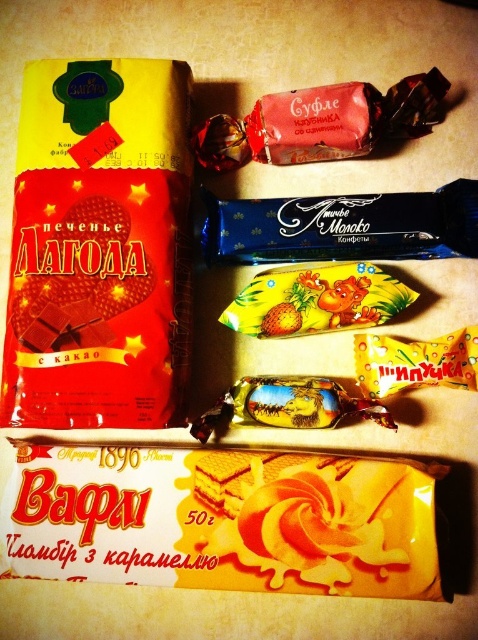
You are a customer at a bakery and see the image. There is a point marked at coordinates (98, 246). What item is located at this point?

The point at coordinates (98, 246) corresponds to the matte chocolate cookie at left.

You are a customer at a bakery shop and want to buy a chocolate item. You see a matte chocolate cookie at left and a shiny chocolate bar at center. Which one is larger in size?

The matte chocolate cookie at left is bigger than the shiny chocolate bar at center, so the cookie is larger in size.